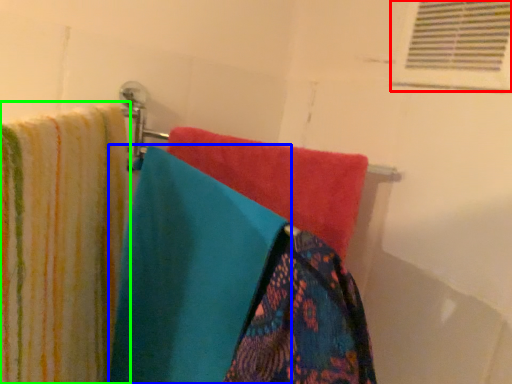
Question: Which object is the closest to the shutter (highlighted by a red box)? Choose among these: towel (highlighted by a blue box) or towel (highlighted by a green box).

Choices:
 (A) towel
 (B) towel

Answer: (A)